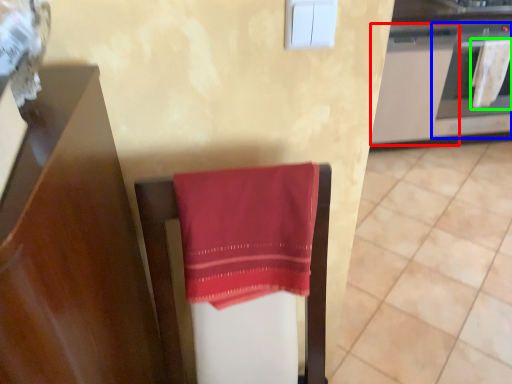
Question: Estimate the real-world distances between objects in this image. Which object is closer to cabinetry (highlighted by a red box), oven (highlighted by a blue box) or beach towel (highlighted by a green box)?

Choices:
 (A) oven
 (B) beach towel

Answer: (A)